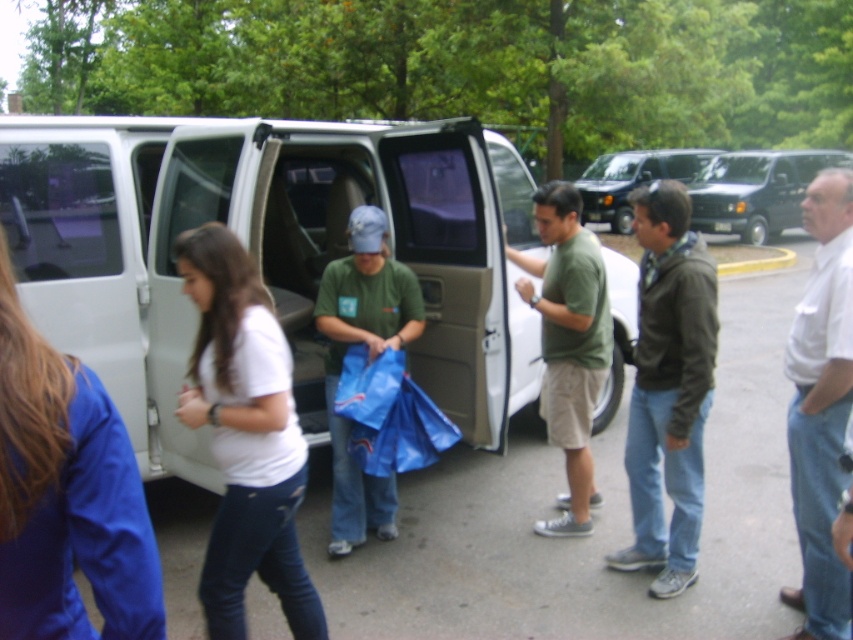
Question: Which object appears farthest from the camera in this image?

Choices:
 (A) black matte van at center
 (B) white cotton shirt at right
 (C) matte black van at upper right

Answer: (A)

Question: Which of these objects is positioned closest to the matte black van at upper right?

Choices:
 (A) white matte van at center
 (B) dark green jacket at center
 (C) black matte van at center
 (D) white cotton shirt at right

Answer: (C)

Question: Does green matte shirt at center come in front of black matte van at center?

Choices:
 (A) yes
 (B) no

Answer: (A)

Question: Which of the following is the farthest from the observer?

Choices:
 (A) green matte shirt at center
 (B) matte black van at upper right
 (C) black matte van at center
 (D) white matte van at center

Answer: (C)

Question: Is dark green jacket at center smaller than black matte van at center?

Choices:
 (A) no
 (B) yes

Answer: (B)

Question: Is white cotton shirt at right thinner than black matte van at center?

Choices:
 (A) no
 (B) yes

Answer: (B)